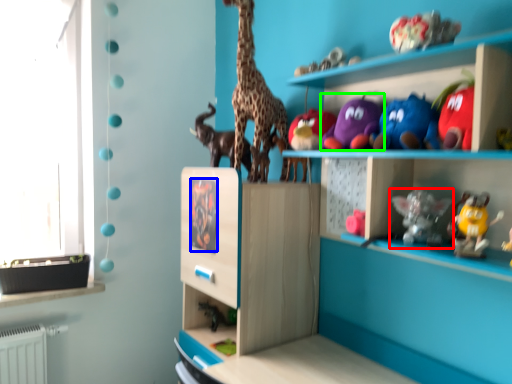
Question: Considering the real-world distances, which object is closest to toy (highlighted by a red box)? animal (highlighted by a blue box) or toy (highlighted by a green box).

Choices:
 (A) animal
 (B) toy

Answer: (B)